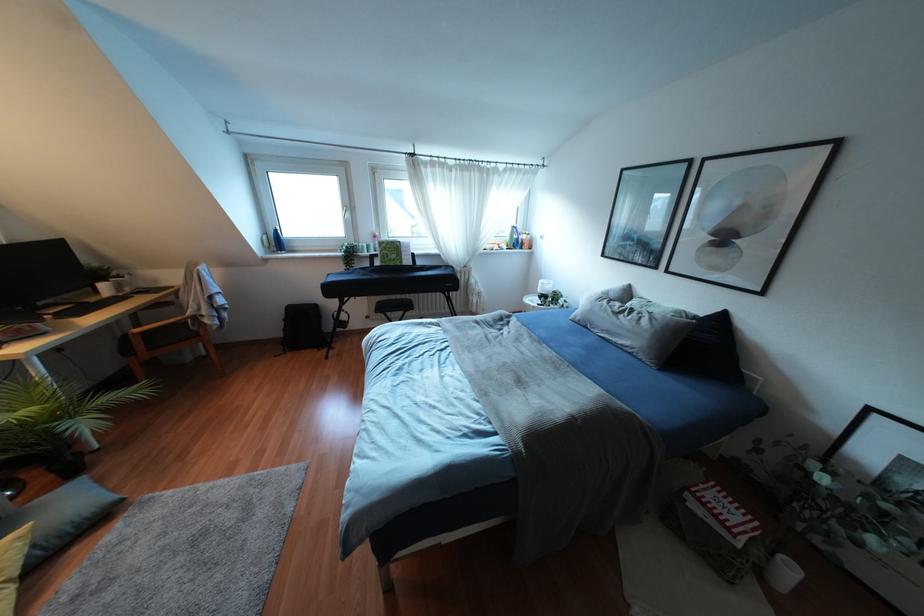
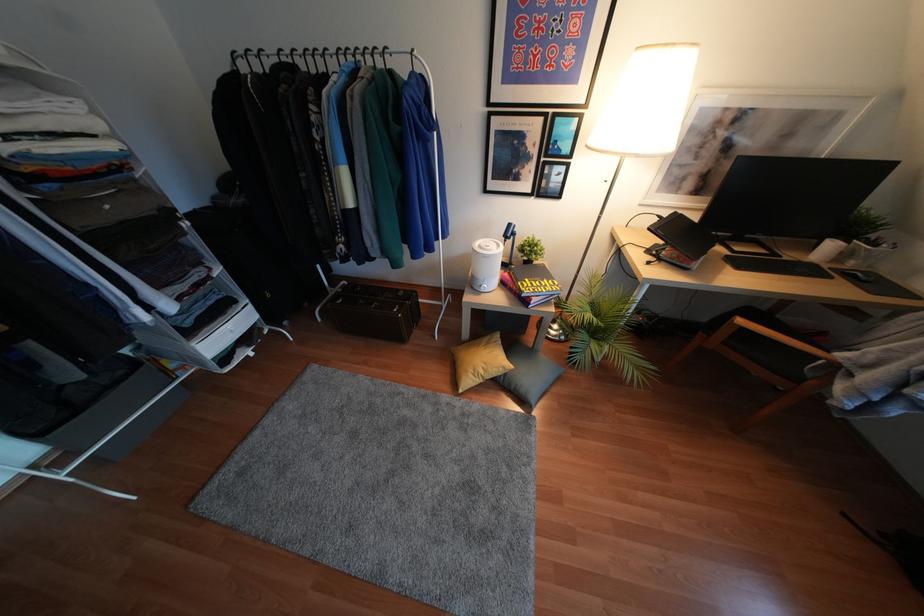
In the second image, find the point that corresponds to point 135,330 in the first image.

(739, 321)